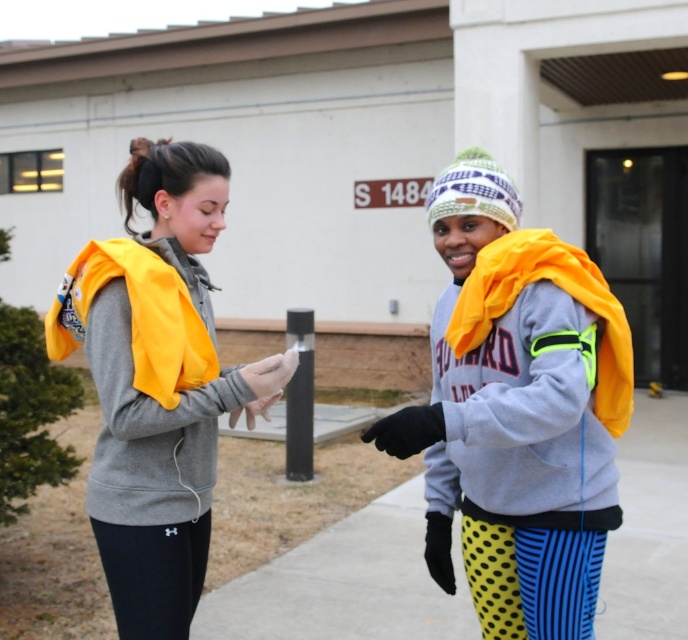
You are a photographer trying to capture a photo of both the gray fleece sweatshirt at right and the yellow polka dot leggings at lower center in the same frame. The minimum distance between the two objects must be at least 9 inches to ensure they are both clearly visible. Will you be able to achieve this?

The gray fleece sweatshirt at right and yellow polka dot leggings at lower center are 8.87 inches apart from each other, which is less than the required 9 inches. Therefore, they cannot both be clearly visible in the same frame with the desired separation.

You are a fashion designer analyzing the outfit of two people in the image. Which item, the yellow knit beanie at center or the yellow polka dot leggings at lower center, is positioned higher in the image?

The yellow knit beanie at center is much taller than the yellow polka dot leggings at lower center, so the yellow knit beanie at center is positioned higher in the image.

You are a fashion designer observing the two people in the image. You need to determine which clothing item is positioned higher on the body between the matte gray hoodie at center and the yellow polka dot leggings at lower center. Which one is higher?

The matte gray hoodie at center is positioned above the yellow polka dot leggings at lower center, so the matte gray hoodie at center is higher on the body.